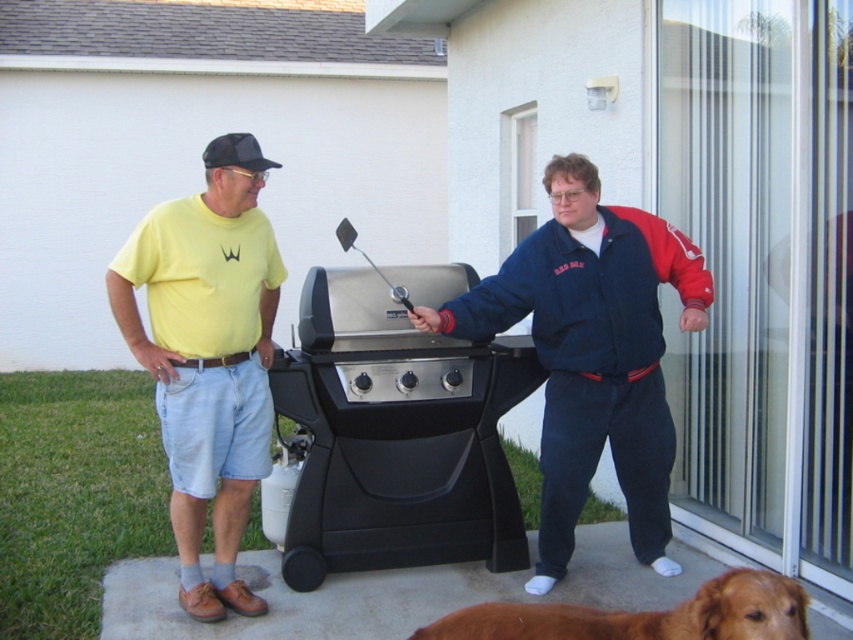
You are a delivery person who needs to place a 1.5 meter long package between the black matte barbecue grill at center and the brown furry dog at lower right. Is there enough space to fit the package horizontally without moving either object?

The distance between the black matte barbecue grill at center and the brown furry dog at lower right is 1.73 meters. Since the package is 1.5 meters long, there is sufficient space to place it horizontally between them without moving either object.

You are planning to place a new decorative pot on the patio. The existing barbecue grill is located at point (396, 436). If you want to place the pot 0.2 units to the right and 0.1 units above the grill, what are the coordinates of the pot?

The coordinates of the pot would be calculated by adding 0.2 to the x coordinate and 0.1 to the y coordinate of the grill. The grill is at (396, 436), so the pot would be at 0.884, 0.565.